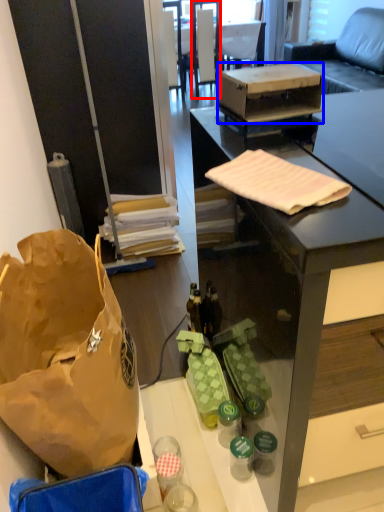
Question: Among these objects, which one is nearest to the camera, chair (highlighted by a red box) or box (highlighted by a blue box)?

Choices:
 (A) chair
 (B) box

Answer: (B)